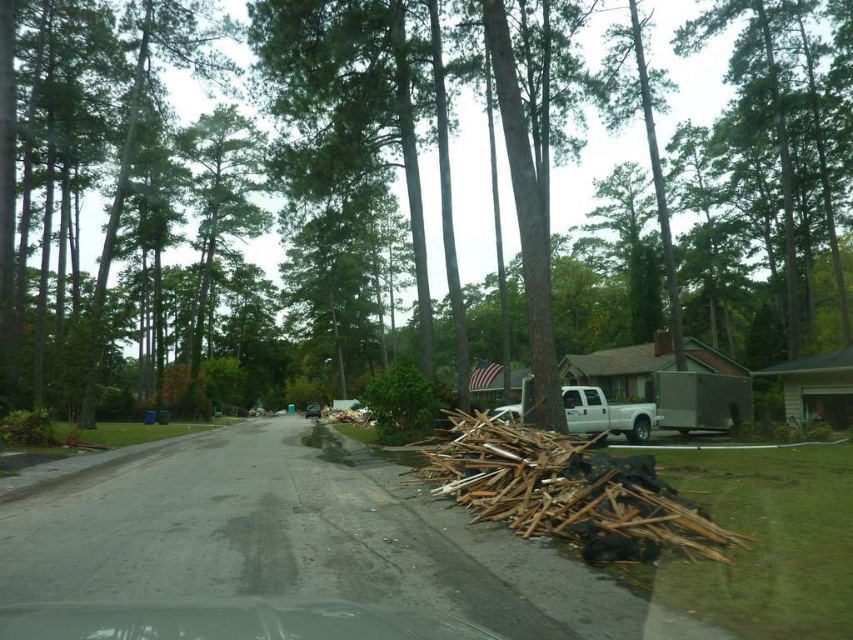
Question: Which object is the farthest from the transparent plastic windshield at lower center?

Choices:
 (A) brown wood debris at lower right
 (B) brown wood tree at center

Answer: (B)

Question: Can you confirm if brown wood debris at lower right is thinner than transparent plastic windshield at lower center?

Choices:
 (A) yes
 (B) no

Answer: (A)

Question: Among these points, which one is farthest from the camera?

Choices:
 (A) (573, 461)
 (B) (212, 627)

Answer: (A)

Question: Which of these objects is positioned closest to the brown wood tree at center?

Choices:
 (A) brown wood debris at lower right
 (B) metallic silver trailer at right

Answer: (B)

Question: Does brown wood debris at lower right appear over metallic silver car at center?

Choices:
 (A) yes
 (B) no

Answer: (A)

Question: Is transparent plastic windshield at lower center to the right of white matte truck at center from the viewer's perspective?

Choices:
 (A) no
 (B) yes

Answer: (A)